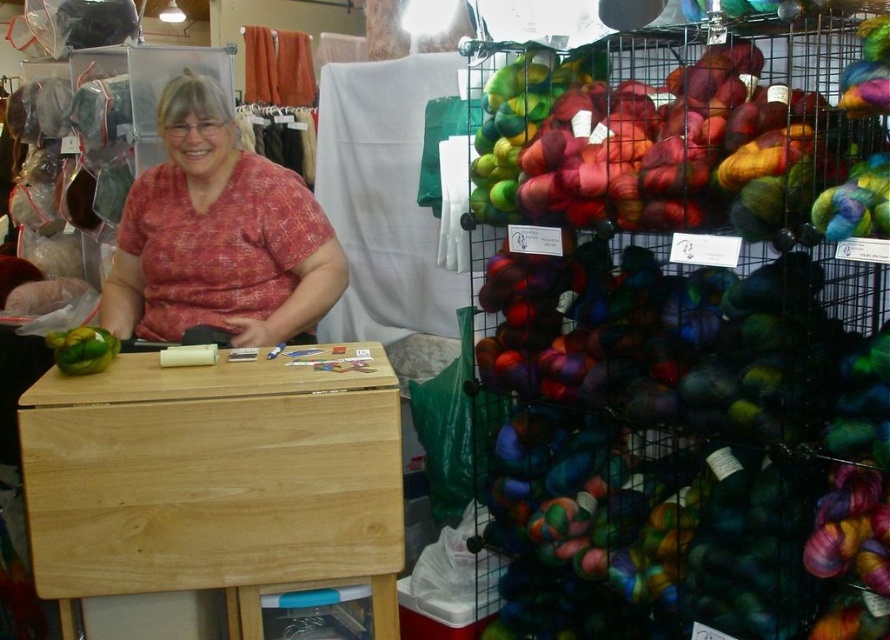
Is point (872, 556) positioned behind point (332, 301)?

No, it is not.

Does multicolored yarn at right have a greater width compared to matte red shirt at center?

Yes.

Is point (712, 604) in front of point (156, 276)?

That is True.

The width and height of the screenshot is (890, 640). Find the location of `multicolored yarn at right`. multicolored yarn at right is located at coordinates (684, 342).